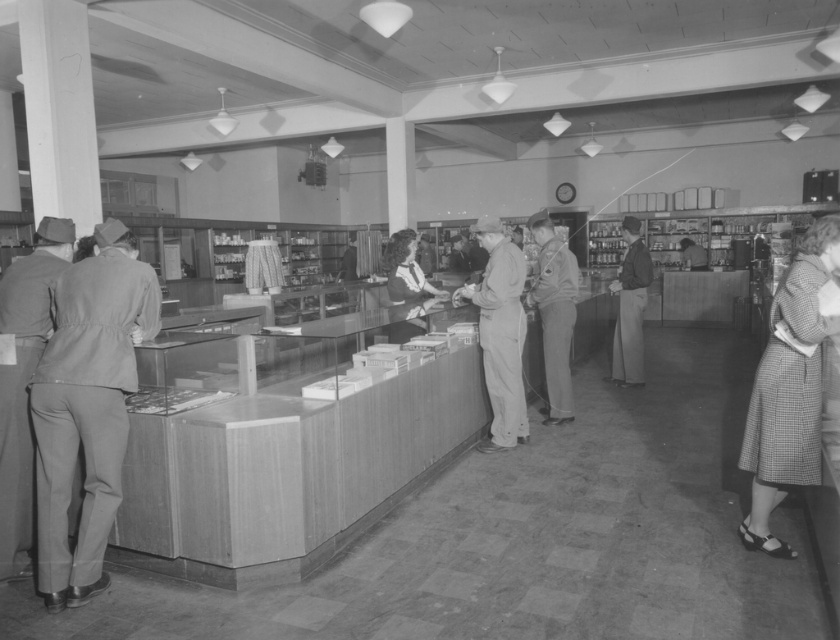
Is matte khaki uniform at left positioned at the back of dark gray uniform at center?

No, matte khaki uniform at left is closer to the viewer.

Between point (12, 369) and point (615, 368), which one is positioned behind?

The point (615, 368) is behind.

At what (x,y) coordinates should I click in order to perform the action: click on matte khaki uniform at left. Please return your answer as a coordinate pair (x, y). The height and width of the screenshot is (640, 840). Looking at the image, I should click on (24, 381).

Based on the photo, who is lower down, smooth gray suit at left or checkered fabric skirt at lower right?

smooth gray suit at left

Between smooth gray suit at left and checkered fabric skirt at lower right, which one appears on the left side from the viewer's perspective?

smooth gray suit at left is more to the left.

This screenshot has height=640, width=840. I want to click on smooth gray suit at left, so click(x=87, y=408).

At what (x,y) coordinates should I click in order to perform the action: click on smooth gray suit at left. Please return your answer as a coordinate pair (x, y). Looking at the image, I should click on (87, 408).

Who is higher up, smooth gray suit at left or curly-haired woman at center?

curly-haired woman at center is above.

What are the coordinates of `smooth gray suit at left` in the screenshot? It's located at (87, 408).